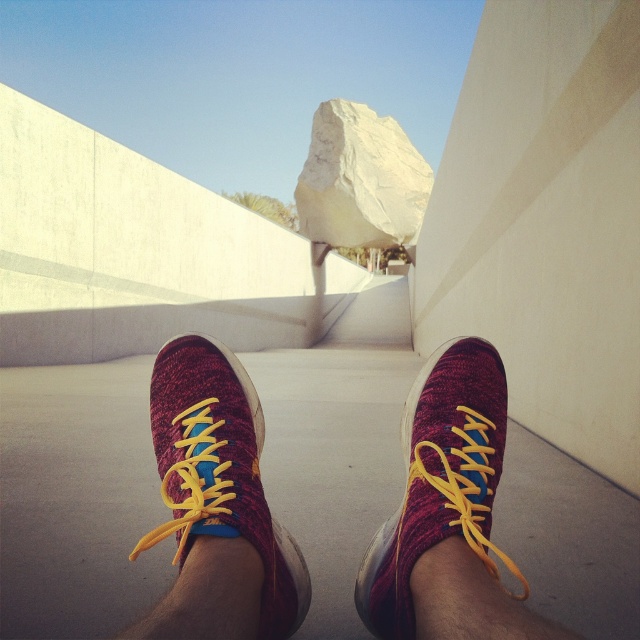
Question: Which object is the closest to the white smooth rock at center?

Choices:
 (A) knitted fabric sneakers at center
 (B) maroon knit/yarn sneaker at center

Answer: (B)

Question: Can you confirm if maroon knit/yarn sneaker at center is wider than white smooth rock at center?

Choices:
 (A) no
 (B) yes

Answer: (A)

Question: Which of the following is the farthest from the observer?

Choices:
 (A) maroon knit/yarn sneaker at center
 (B) knitted fabric sneakers at center
 (C) white smooth rock at center
 (D) knitted/mesh running shoe at center

Answer: (C)

Question: Is knitted fabric sneakers at center to the right of white smooth rock at center from the viewer's perspective?

Choices:
 (A) yes
 (B) no

Answer: (B)

Question: Which of the following is the farthest from the observer?

Choices:
 (A) maroon knit/yarn sneaker at center
 (B) knitted fabric sneakers at center
 (C) white smooth rock at center
 (D) knitted/mesh running shoe at center

Answer: (C)

Question: Does knitted fabric sneakers at center have a greater width compared to knitted/mesh running shoe at center?

Choices:
 (A) no
 (B) yes

Answer: (B)